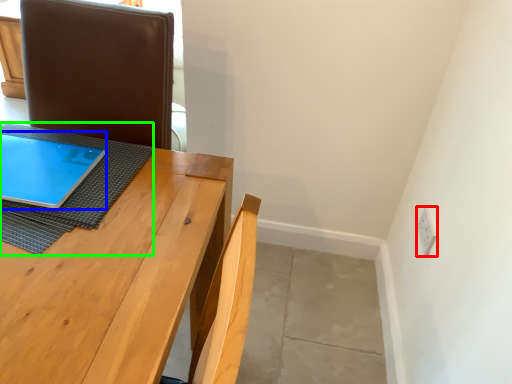
Question: Which is farther away from electric outlet (highlighted by a red box)? tablet computer (highlighted by a blue box) or cloth (highlighted by a green box)?

Choices:
 (A) tablet computer
 (B) cloth

Answer: (A)